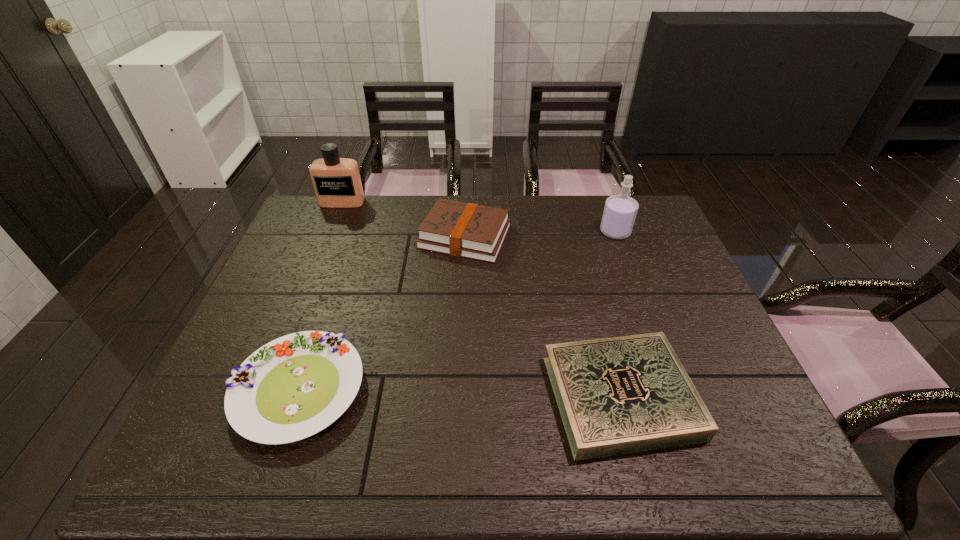
Find the location of a particular element. vacant point located 0.400m on the front of the third object from left to right is located at coordinates (459, 377).

Locate an element on the screen. Image resolution: width=960 pixels, height=540 pixels. free region located on the left of the right hardback book is located at coordinates (423, 396).

At what (x,y) coordinates should I click in order to perform the action: click on vacant space located on the right of the salad plate. Please return your answer as a coordinate pair (x, y). The width and height of the screenshot is (960, 540). Looking at the image, I should click on (447, 389).

Where is `hardback book that is at the far edge`? Image resolution: width=960 pixels, height=540 pixels. hardback book that is at the far edge is located at coordinates (468, 230).

Find the location of a particular element. hardback book situated at the near edge is located at coordinates (618, 395).

Image resolution: width=960 pixels, height=540 pixels. I want to click on salad plate present at the near edge, so click(293, 387).

I want to click on perfume that is at the left edge, so click(337, 183).

The image size is (960, 540). I want to click on salad plate present at the left edge, so click(293, 387).

You are a GUI agent. You are given a task and a screenshot of the screen. Output one action in this format:
    pyautogui.click(x=<x>, y=<y>)
    Task: Click on the perfume located in the right edge section of the desktop
    Image resolution: width=960 pixels, height=540 pixels.
    Given the screenshot: What is the action you would take?
    pyautogui.click(x=620, y=211)

At what (x,y) coordinates should I click in order to perform the action: click on hardback book present at the right edge. Please return your answer as a coordinate pair (x, y). Looking at the image, I should click on (618, 395).